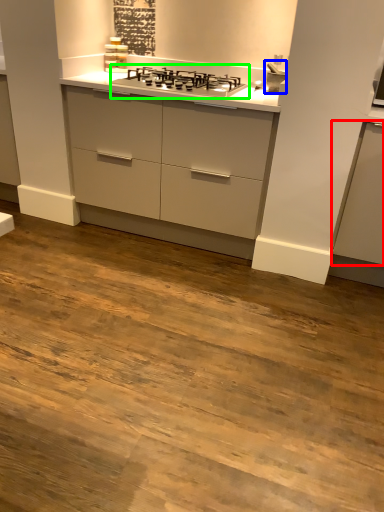
Question: Estimate the real-world distances between objects in this image. Which object is farther from cabinetry (highlighted by a red box), sink (highlighted by a blue box) or gas stove (highlighted by a green box)?

Choices:
 (A) sink
 (B) gas stove

Answer: (B)